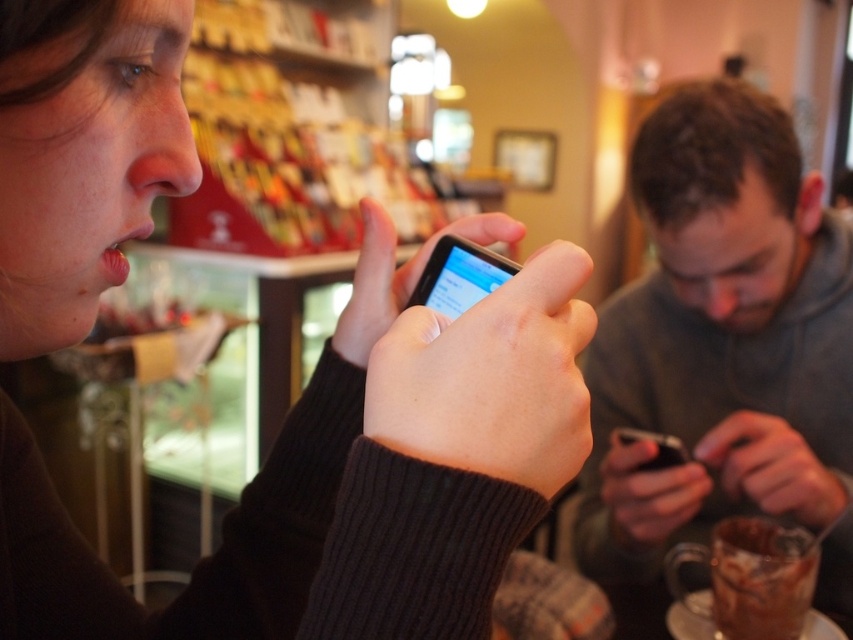
Can you confirm if matte black phone at center is shorter than gray hoodie at center?

Correct, matte black phone at center is not as tall as gray hoodie at center.

Based on the photo, how distant is matte black phone at center from gray hoodie at center?

matte black phone at center is 26.40 inches away from gray hoodie at center.

The image size is (853, 640). I want to click on matte black phone at center, so click(x=352, y=476).